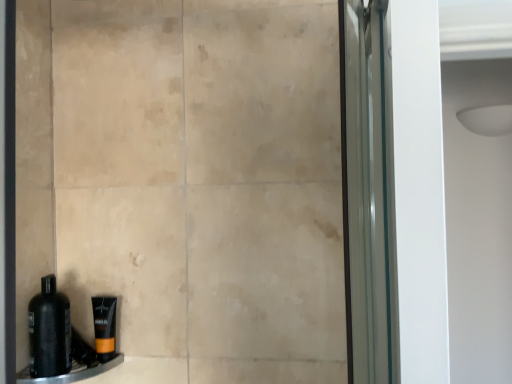
Question: From the image's perspective, would you say orange matte tube at lower left is shown under black matte bottle at lower left?

Choices:
 (A) yes
 (B) no

Answer: (A)

Question: Is orange matte tube at lower left surrounding black matte bottle at lower left?

Choices:
 (A) yes
 (B) no

Answer: (B)

Question: Is orange matte tube at lower left completely or partially outside of black matte bottle at lower left?

Choices:
 (A) yes
 (B) no

Answer: (A)

Question: Is orange matte tube at lower left touching black matte bottle at lower left?

Choices:
 (A) yes
 (B) no

Answer: (B)

Question: Is the depth of orange matte tube at lower left less than that of black matte bottle at lower left?

Choices:
 (A) yes
 (B) no

Answer: (B)

Question: Is orange matte tube at lower left shorter than black matte bottle at lower left?

Choices:
 (A) yes
 (B) no

Answer: (A)

Question: From the image's perspective, is black plastic ledge at lower left located above orange matte tube at lower left?

Choices:
 (A) no
 (B) yes

Answer: (A)

Question: Can you confirm if black plastic ledge at lower left is smaller than orange matte tube at lower left?

Choices:
 (A) yes
 (B) no

Answer: (B)

Question: From a real-world perspective, does black plastic ledge at lower left sit lower than orange matte tube at lower left?

Choices:
 (A) yes
 (B) no

Answer: (A)

Question: Considering the relative positions of black plastic ledge at lower left and orange matte tube at lower left in the image provided, is black plastic ledge at lower left behind orange matte tube at lower left?

Choices:
 (A) no
 (B) yes

Answer: (A)

Question: Can you see black plastic ledge at lower left touching orange matte tube at lower left?

Choices:
 (A) yes
 (B) no

Answer: (A)

Question: Would you say orange matte tube at lower left is part of black plastic ledge at lower left's contents?

Choices:
 (A) no
 (B) yes

Answer: (A)

Question: Is orange matte tube at lower left wider than black plastic ledge at lower left?

Choices:
 (A) no
 (B) yes

Answer: (A)